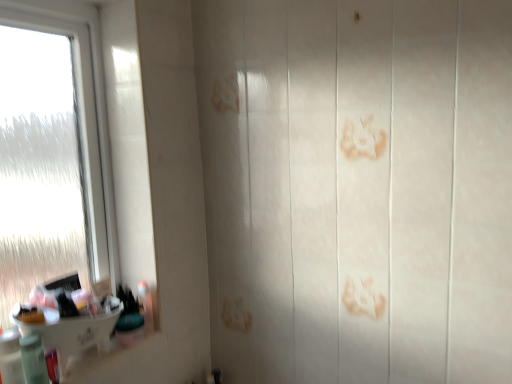
Question: Should I look upward or downward to see translucent plastic bottle at lower left, the fourth toiletry in the back-to-front sequence?

Choices:
 (A) down
 (B) up

Answer: (A)

Question: Is translucent plastic bottle at lower left, the 4th toiletry in the right-to-left sequence, in front of translucent plastic bottle at lower left, which appears as the 2th toiletry when viewed from the front?

Choices:
 (A) no
 (B) yes

Answer: (B)

Question: Is translucent plastic bottle at lower left, the fourth toiletry in the back-to-front sequence, further to the viewer compared to translucent plastic bottle at lower left, which is the third toiletry in right-to-left order?

Choices:
 (A) no
 (B) yes

Answer: (A)

Question: Is translucent plastic bottle at lower left, positioned as the 1th toiletry in left-to-right order, outside of translucent plastic bottle at lower left, which is the third toiletry in right-to-left order?

Choices:
 (A) no
 (B) yes

Answer: (B)

Question: Can you confirm if translucent plastic bottle at lower left, the fourth toiletry in the back-to-front sequence, is shorter than translucent plastic bottle at lower left, which appears as the 2th toiletry when viewed from the front?

Choices:
 (A) yes
 (B) no

Answer: (B)

Question: From the image's perspective, is translucent plastic bottle at lower left, the fourth toiletry in the back-to-front sequence, on translucent plastic bottle at lower left, which is the third toiletry in right-to-left order?

Choices:
 (A) no
 (B) yes

Answer: (B)

Question: Is translucent plastic bottle at lower left, the 4th toiletry in the right-to-left sequence, facing towards translucent plastic bottle at lower left, which is the second toiletry in left-to-right order?

Choices:
 (A) yes
 (B) no

Answer: (B)

Question: Is green plastic container at lower left, the 1th toiletry in the right-to-left sequence, placed right next to white glossy sink at lower left?

Choices:
 (A) no
 (B) yes

Answer: (A)

Question: From the image's perspective, is green plastic container at lower left, the first toiletry in the back-to-front sequence, under white glossy sink at lower left?

Choices:
 (A) no
 (B) yes

Answer: (B)

Question: From a real-world perspective, is green plastic container at lower left, the first toiletry in the back-to-front sequence, located beneath white glossy sink at lower left?

Choices:
 (A) no
 (B) yes

Answer: (B)

Question: Can you confirm if green plastic container at lower left, the first toiletry in the back-to-front sequence, is bigger than white glossy sink at lower left?

Choices:
 (A) yes
 (B) no

Answer: (B)

Question: From the image's perspective, does green plastic container at lower left, which is the fourth toiletry from left to right, appear higher than white glossy sink at lower left?

Choices:
 (A) no
 (B) yes

Answer: (A)

Question: Is white glossy sink at lower left located within green plastic container at lower left, the 1th toiletry in the right-to-left sequence?

Choices:
 (A) yes
 (B) no

Answer: (B)

Question: Is transparent frosted glass at left smaller than green plastic container at lower left, the 1th toiletry in the right-to-left sequence?

Choices:
 (A) yes
 (B) no

Answer: (B)